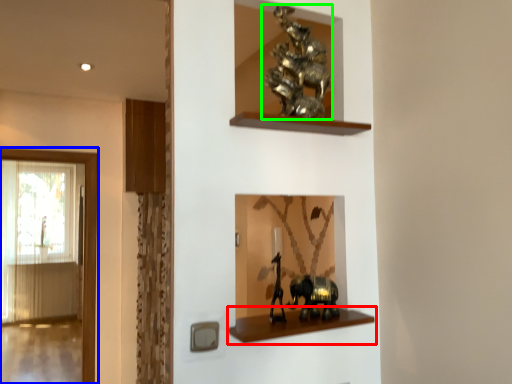
Question: Based on their relative distances, which object is farther from shelf (highlighted by a red box)? Choose from window (highlighted by a blue box) and animal (highlighted by a green box).

Choices:
 (A) window
 (B) animal

Answer: (A)